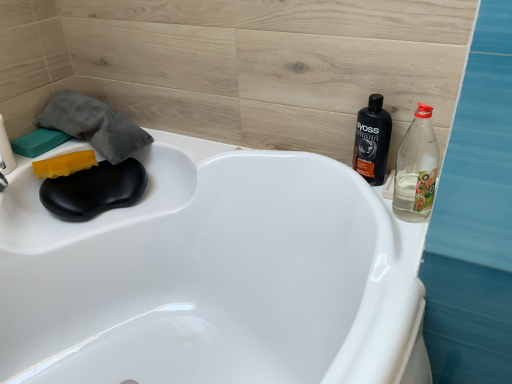
Question: Is green sponge at upper left, the first soap positioned from the left, a part of yellow sponge at left, acting as the 2th soap starting from the left?

Choices:
 (A) yes
 (B) no

Answer: (B)

Question: Can you confirm if yellow sponge at left, acting as the 2th soap starting from the left, is positioned to the right of green sponge at upper left, the 2th soap viewed from the right?

Choices:
 (A) yes
 (B) no

Answer: (A)

Question: From the image's perspective, is yellow sponge at left, acting as the 2th soap starting from the left, above green sponge at upper left, the 2th soap viewed from the right?

Choices:
 (A) no
 (B) yes

Answer: (A)

Question: Is yellow sponge at left, acting as the first soap starting from the right, shorter than green sponge at upper left, the 2th soap viewed from the right?

Choices:
 (A) no
 (B) yes

Answer: (A)

Question: From the image's perspective, is yellow sponge at left, acting as the first soap starting from the right, located beneath green sponge at upper left, the first soap positioned from the left?

Choices:
 (A) yes
 (B) no

Answer: (A)

Question: Is green sponge at upper left, the 2th soap viewed from the right, bigger or smaller than clear plastic bottle at right, which is counted as the first bottle, starting from the front?

Choices:
 (A) big
 (B) small

Answer: (B)

Question: In terms of width, does green sponge at upper left, the first soap positioned from the left, look wider or thinner when compared to clear plastic bottle at right, which is counted as the first bottle, starting from the front?

Choices:
 (A) thin
 (B) wide

Answer: (B)

Question: Is green sponge at upper left, the 2th soap viewed from the right, to the left or to the right of clear plastic bottle at right, the 2th bottle when ordered from back to front, in the image?

Choices:
 (A) right
 (B) left

Answer: (B)

Question: Considering the positions of point (41, 142) and point (404, 160), is point (41, 142) closer or farther from the camera than point (404, 160)?

Choices:
 (A) farther
 (B) closer

Answer: (A)

Question: From their relative heights in the image, would you say clear plastic bottle at right, which is counted as the first bottle, starting from the front, is taller or shorter than green sponge at upper left, the first soap positioned from the left?

Choices:
 (A) short
 (B) tall

Answer: (B)

Question: From a real-world perspective, relative to green sponge at upper left, the 2th soap viewed from the right, is clear plastic bottle at right, which is counted as the first bottle, starting from the front, vertically above or below?

Choices:
 (A) above
 (B) below

Answer: (A)

Question: Is point (416, 142) closer or farther from the camera than point (27, 153)?

Choices:
 (A) closer
 (B) farther

Answer: (A)

Question: Do you think clear plastic bottle at right, the 2th bottle when ordered from back to front, is within green sponge at upper left, the 2th soap viewed from the right, or outside of it?

Choices:
 (A) outside
 (B) inside

Answer: (A)

Question: From a real-world perspective, is yellow sponge at left, acting as the 2th soap starting from the left, positioned above or below clear plastic bottle at right, which is counted as the first bottle, starting from the front?

Choices:
 (A) above
 (B) below

Answer: (B)

Question: Is point (38, 177) closer or farther from the camera than point (409, 198)?

Choices:
 (A) farther
 (B) closer

Answer: (A)